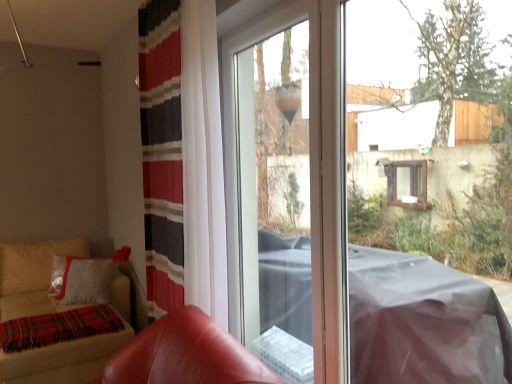
Question: Considering the positions of point (89, 319) and point (275, 253), is point (89, 319) closer or farther from the camera than point (275, 253)?

Choices:
 (A) farther
 (B) closer

Answer: (A)

Question: Looking at the image, does plaid woolen blanket at lower left seem bigger or smaller compared to transparent plastic screen door at center?

Choices:
 (A) small
 (B) big

Answer: (A)

Question: Based on their relative distances, which object is farther from the leather armchair at lower left?

Choices:
 (A) transparent plastic screen door at center
 (B) velvet beige sofa at lower left
 (C) plaid woolen blanket at lower left

Answer: (B)

Question: Which of these objects is positioned farthest from the transparent plastic screen door at center?

Choices:
 (A) velvet beige sofa at lower left
 (B) plaid woolen blanket at lower left
 (C) leather armchair at lower left

Answer: (A)